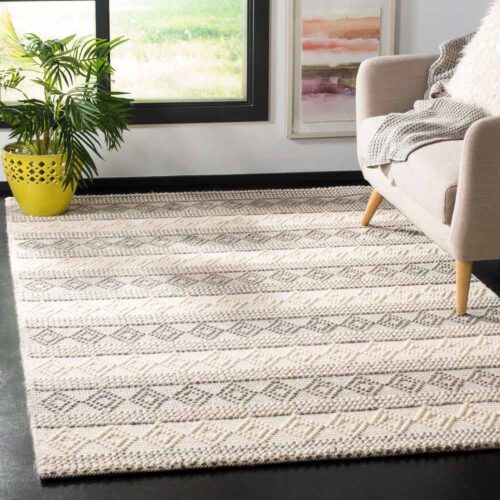
This screenshot has height=500, width=500. What are the coordinates of `space under window` in the screenshot? It's located at (166, 153).